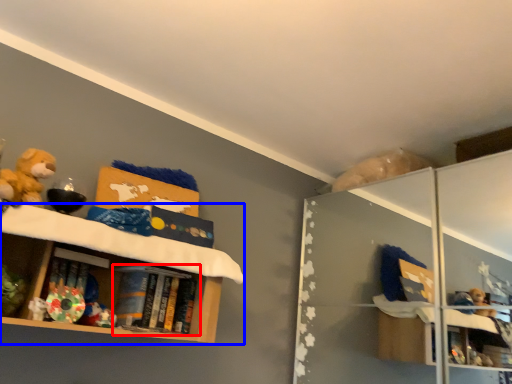
Question: Which of the following is the farthest to the observer, book (highlighted by a red box) or shelf (highlighted by a blue box)?

Choices:
 (A) book
 (B) shelf

Answer: (A)